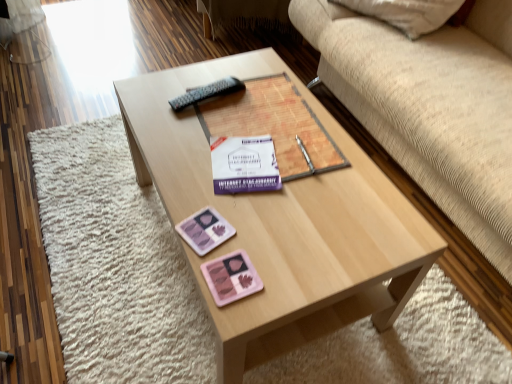
Question: Considering the positions of beige fabric couch at upper right and pink matte eyeshadow palette at lower center, which is the 1th currency from bottom to top, in the image, is beige fabric couch at upper right taller or shorter than pink matte eyeshadow palette at lower center, which is the 1th currency from bottom to top,?

Choices:
 (A) short
 (B) tall

Answer: (B)

Question: From a real-world perspective, is beige fabric couch at upper right above or below pink matte eyeshadow palette at lower center, which is the second currency from top to bottom?

Choices:
 (A) below
 (B) above

Answer: (A)

Question: Which is nearer to the pink matte eyeshadow palette at center, arranged as the 1th currency when viewed from the top?

Choices:
 (A) light wood coffee table at center
 (B) purple matte book at center
 (C) pink matte eyeshadow palette at lower center, which is the 1th currency from bottom to top
 (D) beige fabric couch at upper right
 (E) white paper at center

Answer: (C)

Question: Which of these objects is positioned closest to the beige fabric couch at upper right?

Choices:
 (A) pink matte eyeshadow palette at center, arranged as the second currency when ordered from the bottom
 (B) light wood coffee table at center
 (C) pink matte eyeshadow palette at lower center, which is the second currency from top to bottom
 (D) white paper at center
 (E) purple matte book at center

Answer: (E)